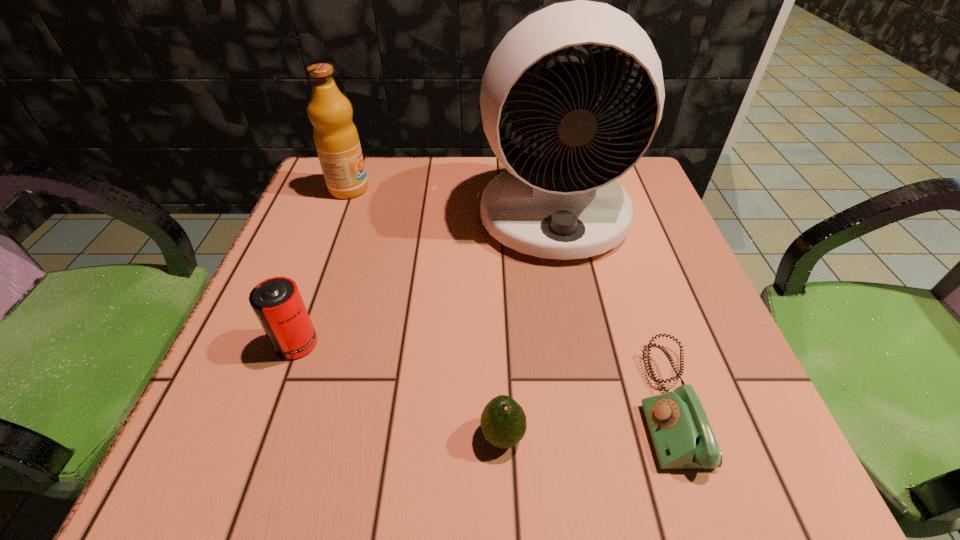
The width and height of the screenshot is (960, 540). Identify the location of object that stands as the closest to the second shortest object. (681, 434).

Identify the location of vacant region that satisfies the following two spatial constraints: 1. on the back side of the can; 2. on the front label of the fruit juice. (352, 189).

Where is `free space that satisfies the following two spatial constraints: 1. on the front label of the fruit juice; 2. on the left side of the third tallest object`? free space that satisfies the following two spatial constraints: 1. on the front label of the fruit juice; 2. on the left side of the third tallest object is located at coordinates (291, 343).

You are a GUI agent. You are given a task and a screenshot of the screen. Output one action in this format:
    pyautogui.click(x=<x>, y=<y>)
    Task: Click on the vacant space that satisfies the following two spatial constraints: 1. on the front side of the third tallest object; 2. on the right side of the avocado
    
    Given the screenshot: What is the action you would take?
    pyautogui.click(x=264, y=436)

Where is `vacant region that satisfies the following two spatial constraints: 1. on the front label of the fruit juice; 2. on the right side of the fourth tallest object`? The image size is (960, 540). vacant region that satisfies the following two spatial constraints: 1. on the front label of the fruit juice; 2. on the right side of the fourth tallest object is located at coordinates (257, 436).

Where is `free location that satisfies the following two spatial constraints: 1. on the dial of the shortest object; 2. on the front side of the avocado`? The width and height of the screenshot is (960, 540). free location that satisfies the following two spatial constraints: 1. on the dial of the shortest object; 2. on the front side of the avocado is located at coordinates (679, 436).